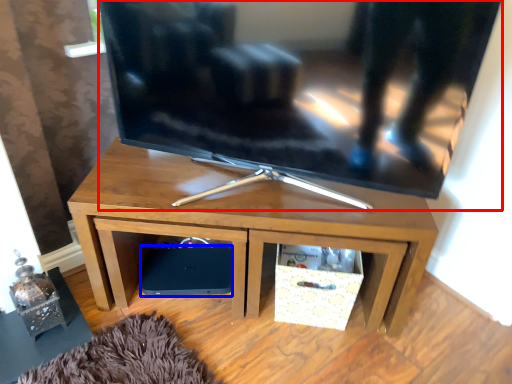
Question: Which object appears farthest to the camera in this image, television (highlighted by a red box) or speaker (highlighted by a blue box)?

Choices:
 (A) television
 (B) speaker

Answer: (B)